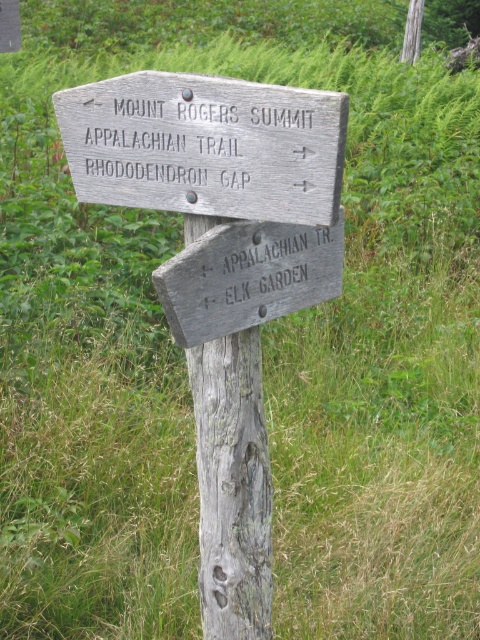
Question: Which point is closer to the camera?

Choices:
 (A) (134, 195)
 (B) (189, 273)

Answer: (B)

Question: Does weathered wood sign at upper center have a greater width compared to weathered wood sign at center?

Choices:
 (A) yes
 (B) no

Answer: (A)

Question: Which object appears farthest from the camera in this image?

Choices:
 (A) weathered wood sign at center
 (B) weathered wood signpost at center
 (C) weathered wood post at center
 (D) weathered wood sign at upper center

Answer: (C)

Question: Which of the following is the farthest from the observer?

Choices:
 (A) (180, 134)
 (B) (86, 109)

Answer: (B)

Question: Is weathered wood signpost at center to the left of weathered wood sign at center from the viewer's perspective?

Choices:
 (A) no
 (B) yes

Answer: (B)

Question: Is weathered wood signpost at center positioned behind weathered wood sign at center?

Choices:
 (A) no
 (B) yes

Answer: (A)